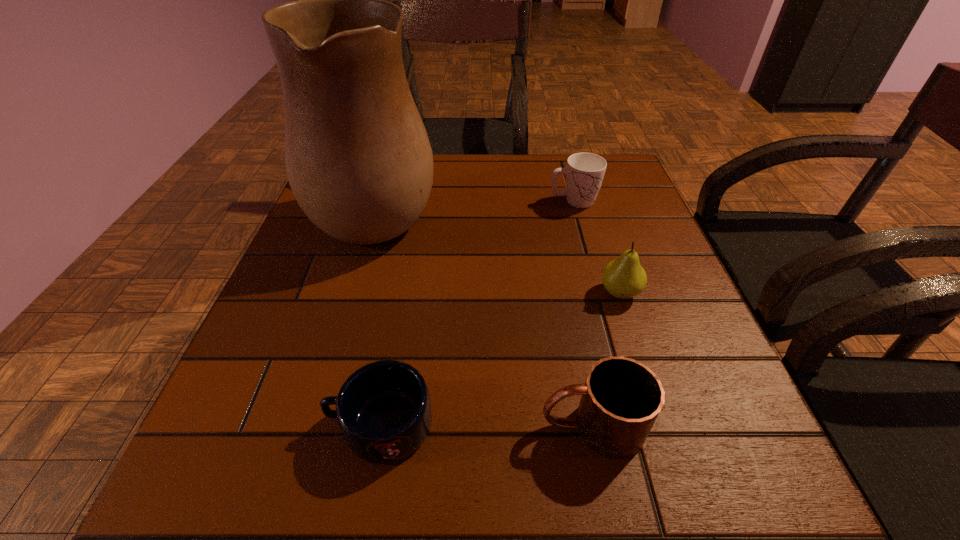
Identify the location of cream pitcher. The width and height of the screenshot is (960, 540). (358, 159).

Identify the location of pear. (624, 278).

Where is `the farthest mug`? the farthest mug is located at coordinates (584, 172).

You are a GUI agent. You are given a task and a screenshot of the screen. Output one action in this format:
    pyautogui.click(x=<x>, y=<y>)
    Task: Click on the shortest mug
    Image resolution: width=960 pixels, height=540 pixels.
    Given the screenshot: What is the action you would take?
    pyautogui.click(x=383, y=409)

Find the location of `the leftmost mug`. the leftmost mug is located at coordinates (383, 409).

You are a GUI agent. You are given a task and a screenshot of the screen. Output one action in this format:
    pyautogui.click(x=<x>, y=<y>)
    Task: Click on the vacant space located 0.250m at the spout of the tallest object
    The height and width of the screenshot is (540, 960).
    Given the screenshot: What is the action you would take?
    point(542,209)

Where is `vacant area situated 0.120m on the left of the pear`? vacant area situated 0.120m on the left of the pear is located at coordinates (538, 293).

Locate an element on the screen. This screenshot has width=960, height=540. free location located 0.090m on the side of the farthest mug with the handle is located at coordinates (635, 201).

Locate an element on the screen. Image resolution: width=960 pixels, height=540 pixels. blank area located 0.060m with the handle on the side of the shortest mug is located at coordinates (288, 424).

Find the location of `vacant region located 0.120m with the handle on the side of the shortest mug`. vacant region located 0.120m with the handle on the side of the shortest mug is located at coordinates (248, 424).